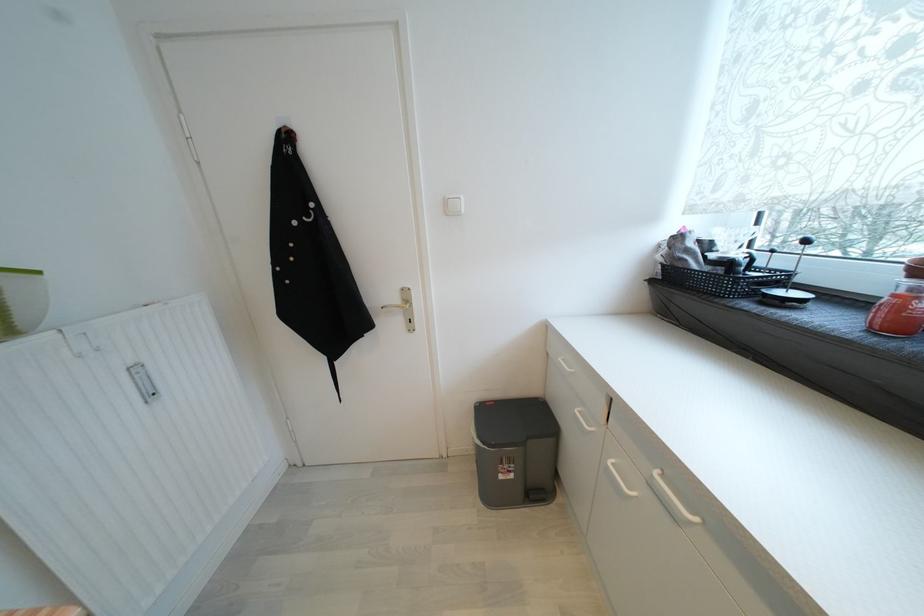
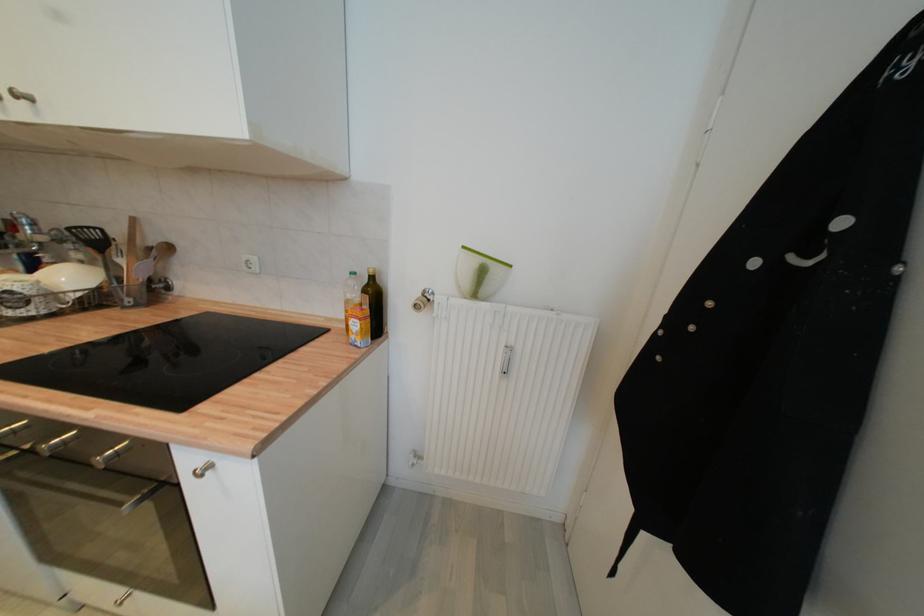
The images are taken continuously from a first-person perspective. In which direction is your viewpoint rotating?

The camera rotated toward left-down.